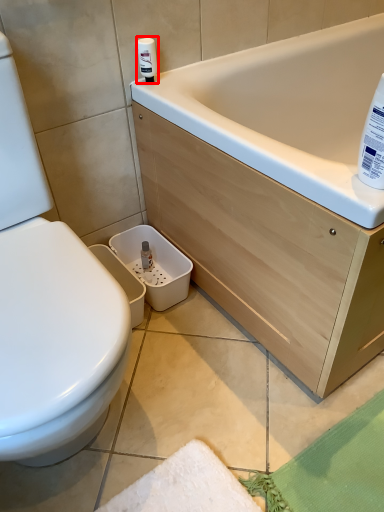
Question: Observing the image, what is the correct spatial positioning of cleaning product (annotated by the red box) in reference to cleaning product?

Choices:
 (A) left
 (B) right

Answer: (A)